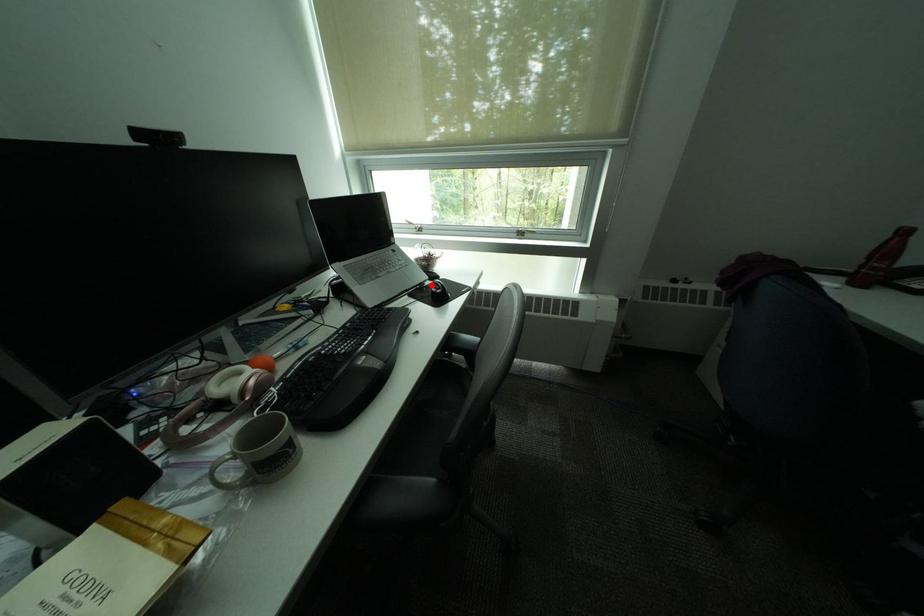
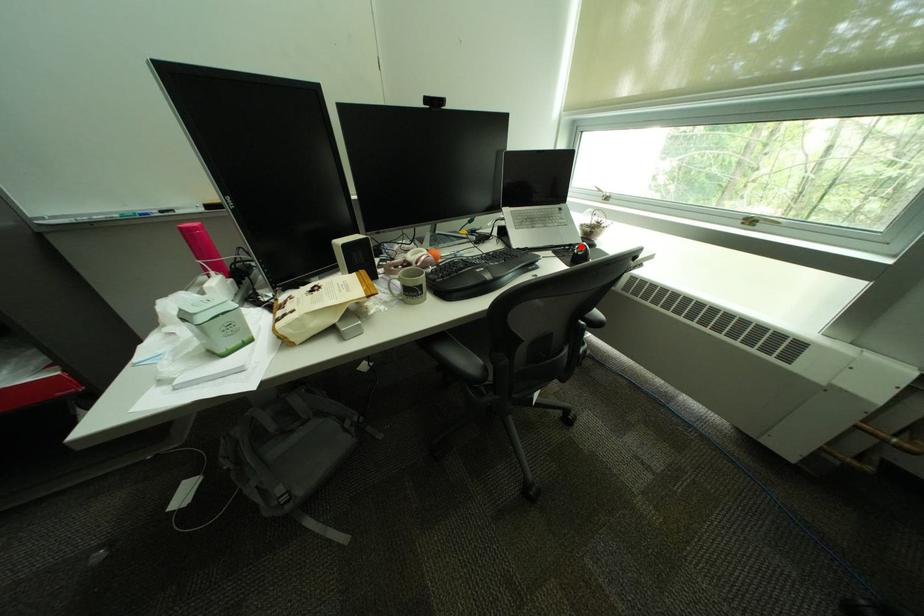
I am providing you with two images of the same scene from different viewpoints. A red point is marked on the first image and another point is marked on the second image. Does the point marked in image1 correspond to the same location as the one in image2?

Yes